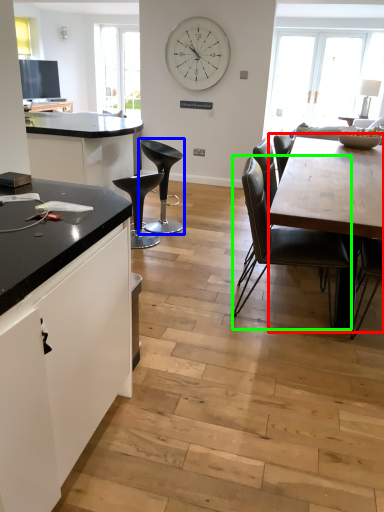
Question: Which is farther away from round table (highlighted by a red box)? chair (highlighted by a blue box) or chair (highlighted by a green box)?

Choices:
 (A) chair
 (B) chair

Answer: (A)